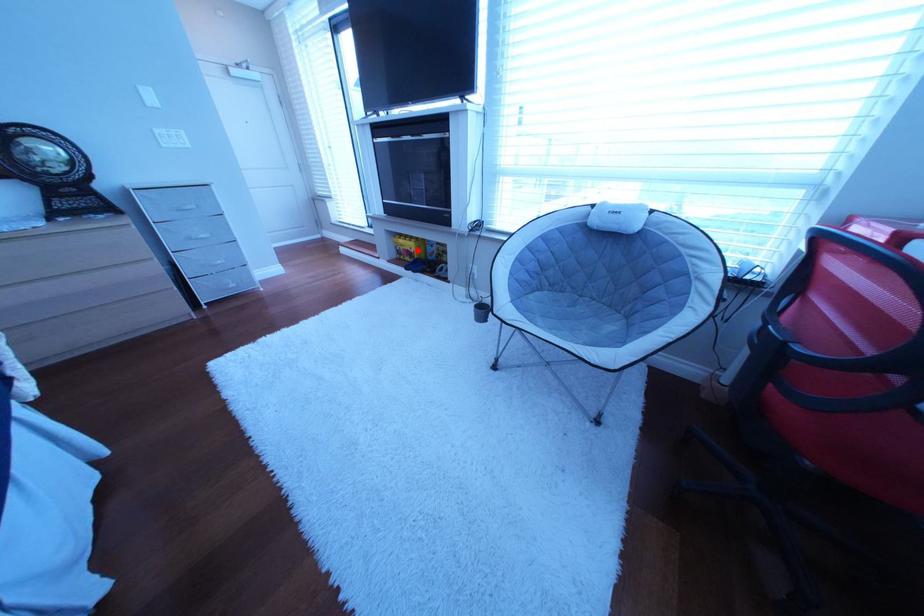
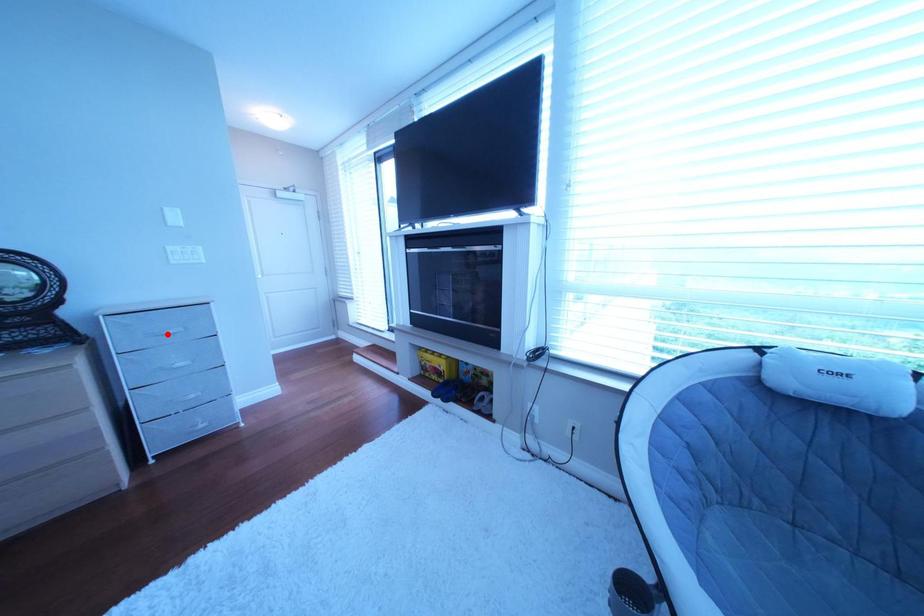
I am providing you with two images of the same scene from different viewpoints. A red point is marked on the first image and another point is marked on the second image. Is the red point in image1 aligned with the point shown in image2?

No